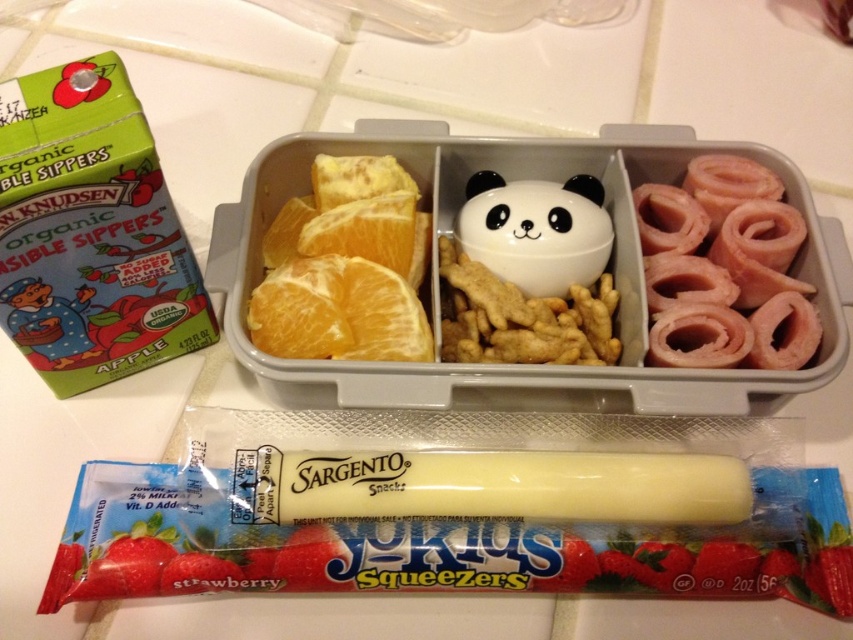
The width and height of the screenshot is (853, 640). What do you see at coordinates (338, 312) in the screenshot?
I see `orangejuicy fleshfruit at left` at bounding box center [338, 312].

Can you confirm if orangejuicy fleshfruit at left is shorter than yellow matte orange at upper left?

No, orangejuicy fleshfruit at left is not shorter than yellow matte orange at upper left.

You are a GUI agent. You are given a task and a screenshot of the screen. Output one action in this format:
    pyautogui.click(x=<x>, y=<y>)
    Task: Click on the orangejuicy fleshfruit at left
    
    Given the screenshot: What is the action you would take?
    click(338, 312)

Does pink/smooth ham rolls at right have a lesser width compared to white glossy panda container at center?

No.

I want to click on pink/smooth ham rolls at right, so click(724, 269).

Is point (671, 250) closer to viewer compared to point (592, 220)?

That is False.

I want to click on pink/smooth ham rolls at right, so click(x=724, y=269).

From the picture: Can you confirm if yellow matte orange at upper left is positioned to the right of matte green apple at left?

Correct, you'll find yellow matte orange at upper left to the right of matte green apple at left.

Is the position of yellow matte orange at upper left more distant than that of matte green apple at left?

Yes, yellow matte orange at upper left is further from the viewer.

Who is more forward, (x=347, y=244) or (x=74, y=324)?

Point (x=74, y=324) is more forward.

Find the location of a particular element. yellow matte orange at upper left is located at coordinates (364, 230).